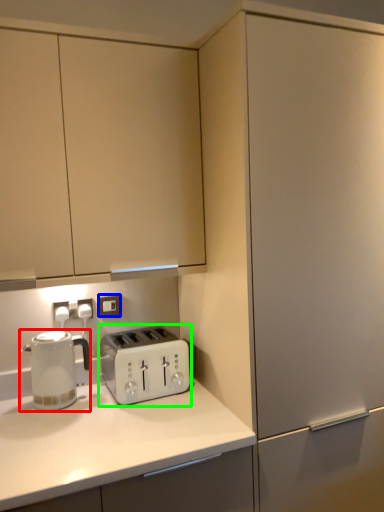
Question: Estimate the real-world distances between objects in this image. Which object is closer to home appliance (highlighted by a red box), electric outlet (highlighted by a blue box) or toaster (highlighted by a green box)?

Choices:
 (A) electric outlet
 (B) toaster

Answer: (B)